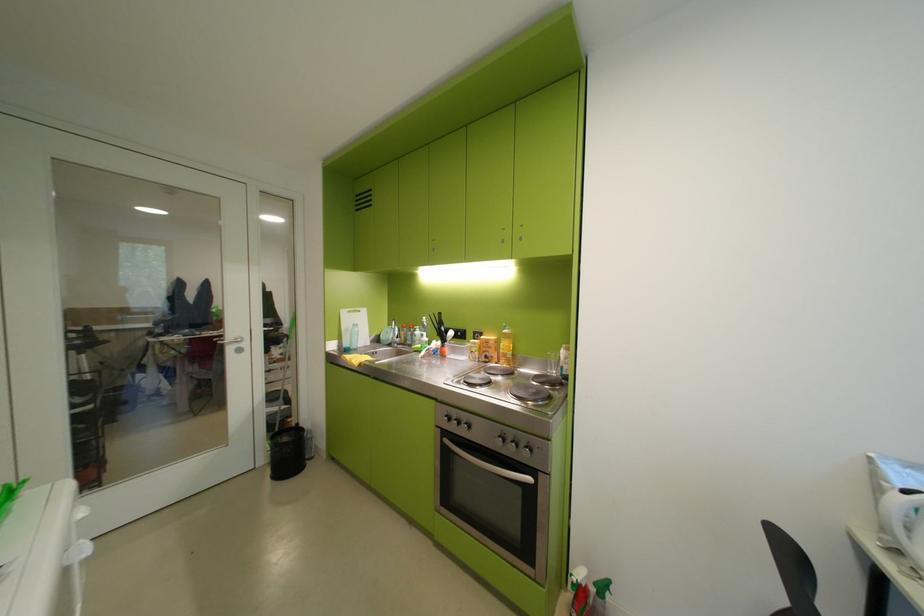
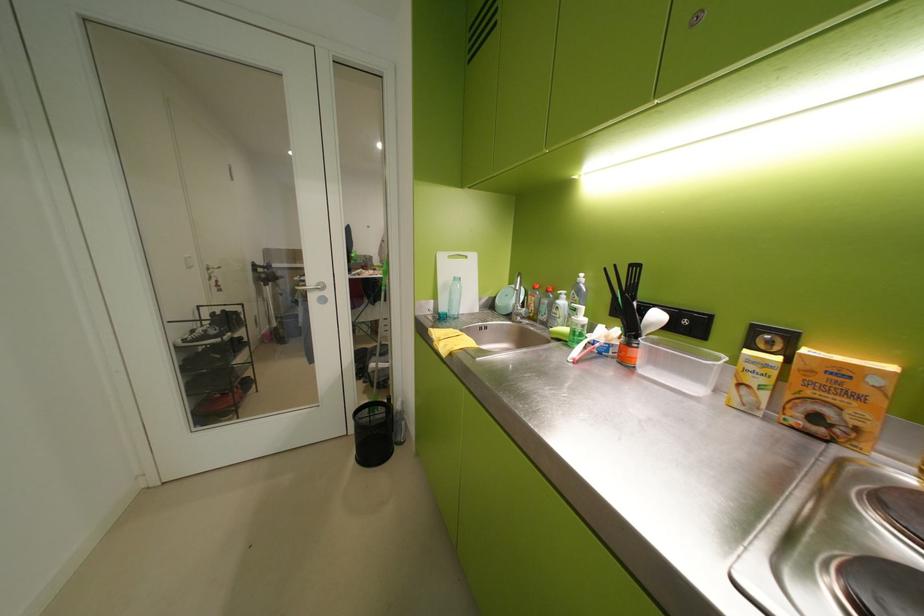
Locate, in the second image, the point that corresponds to (497,342) in the first image.

(852, 373)